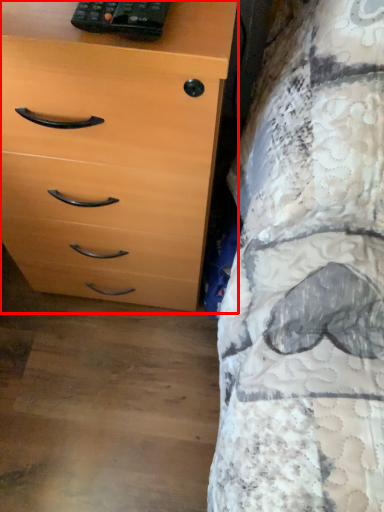
Question: In this image, where is chest of drawers (annotated by the red box) located relative to control?

Choices:
 (A) left
 (B) right

Answer: (A)